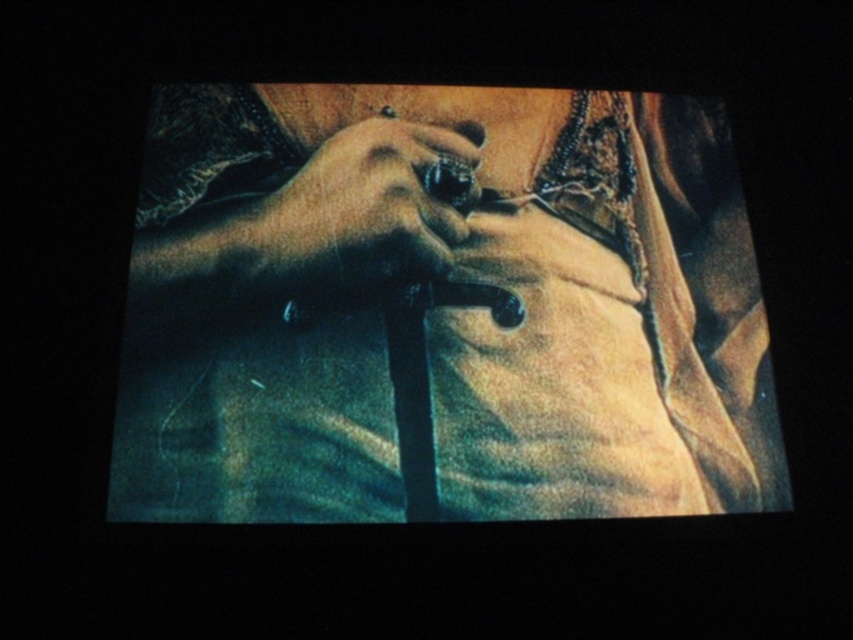
The height and width of the screenshot is (640, 853). Identify the location of matte black cane at center. (440, 307).

Does matte black cane at center appear under smooth leather glove at center?

Yes, matte black cane at center is below smooth leather glove at center.

Does point (512, 205) come behind point (321, 273)?

Yes, it is behind point (321, 273).

Image resolution: width=853 pixels, height=640 pixels. Identify the location of matte black cane at center. (440, 307).